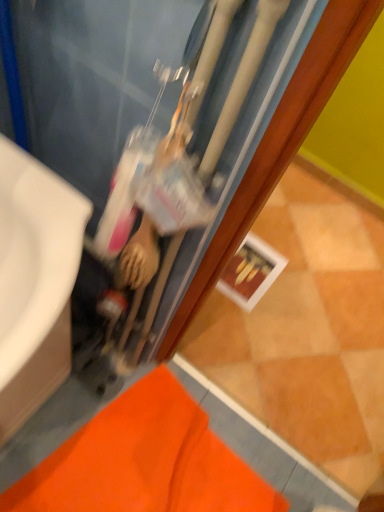
Find the location of a particular element. free spot below orange fabric bath mat at lower left (from a real-world perspective) is located at coordinates (145, 464).